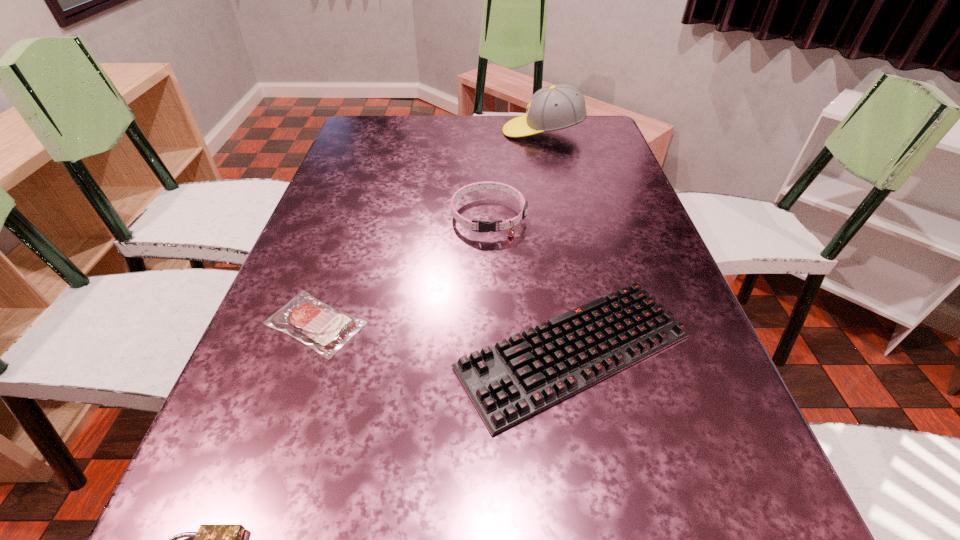
Find the location of a particular element. The height and width of the screenshot is (540, 960). free location located 0.100m on the back of the computer keyboard is located at coordinates (556, 256).

Locate an element on the screen. free space located 0.220m on the front of the steak is located at coordinates (258, 489).

In order to click on object that is at the far edge in this screenshot , I will do `click(559, 106)`.

This screenshot has width=960, height=540. In order to click on object at the left edge in this screenshot , I will do `click(316, 324)`.

Identify the location of baseball cap located in the right edge section of the desktop. This screenshot has height=540, width=960. (559, 106).

Where is `computer keyboard at the right edge`? The image size is (960, 540). computer keyboard at the right edge is located at coordinates (517, 378).

This screenshot has width=960, height=540. In order to click on object present at the far right corner in this screenshot , I will do `click(559, 106)`.

In the image, there is a desktop. Identify the location of free space at the far edge. (556, 147).

Where is `vacant space at the near edge of the desktop`? The image size is (960, 540). vacant space at the near edge of the desktop is located at coordinates (409, 537).

I want to click on blank space at the left edge, so click(x=387, y=157).